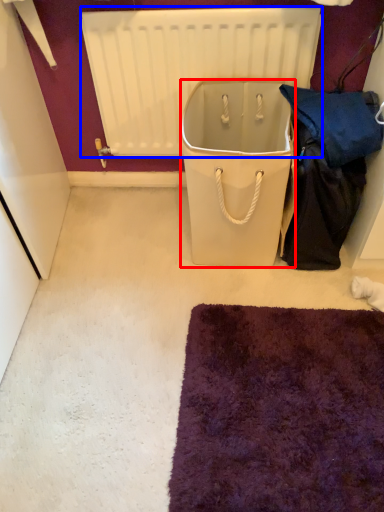
Question: Which object is further to the camera taking this photo, cooler (highlighted by a red box) or radiator (highlighted by a blue box)?

Choices:
 (A) cooler
 (B) radiator

Answer: (B)